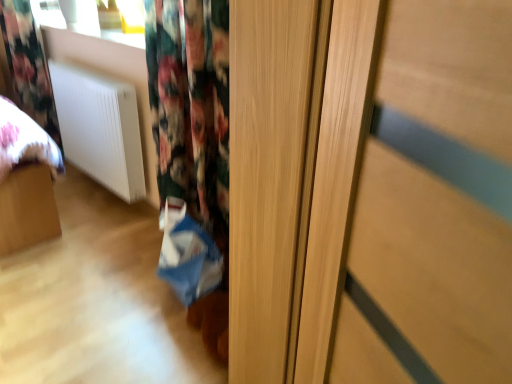
Question: Is floral fabric curtain at upper left shorter than white matte radiator at lower left?

Choices:
 (A) yes
 (B) no

Answer: (B)

Question: Is floral fabric curtain at upper left closer to camera compared to white matte radiator at lower left?

Choices:
 (A) no
 (B) yes

Answer: (A)

Question: Is the depth of floral fabric curtain at upper left greater than that of white matte radiator at lower left?

Choices:
 (A) yes
 (B) no

Answer: (A)

Question: Would you say floral fabric curtain at upper left is outside white matte radiator at lower left?

Choices:
 (A) yes
 (B) no

Answer: (A)

Question: Does floral fabric curtain at upper left have a greater height compared to white matte radiator at lower left?

Choices:
 (A) no
 (B) yes

Answer: (B)

Question: Are floral fabric curtain at upper left and white matte radiator at lower left located far from each other?

Choices:
 (A) no
 (B) yes

Answer: (A)

Question: Does blue fabric shopping bag at lower center have a greater width compared to white matte radiator at lower left?

Choices:
 (A) yes
 (B) no

Answer: (A)

Question: Is blue fabric shopping bag at lower center not near white matte radiator at lower left?

Choices:
 (A) no
 (B) yes

Answer: (A)

Question: Is blue fabric shopping bag at lower center bigger than white matte radiator at lower left?

Choices:
 (A) yes
 (B) no

Answer: (B)

Question: Would you say blue fabric shopping bag at lower center contains white matte radiator at lower left?

Choices:
 (A) yes
 (B) no

Answer: (B)

Question: Does blue fabric shopping bag at lower center have a lesser width compared to white matte radiator at lower left?

Choices:
 (A) yes
 (B) no

Answer: (B)

Question: From a real-world perspective, is blue fabric shopping bag at lower center positioned over white matte radiator at lower left based on gravity?

Choices:
 (A) no
 (B) yes

Answer: (A)

Question: From the image's perspective, is floral fabric curtain at upper left below blue fabric shopping bag at lower center?

Choices:
 (A) no
 (B) yes

Answer: (A)